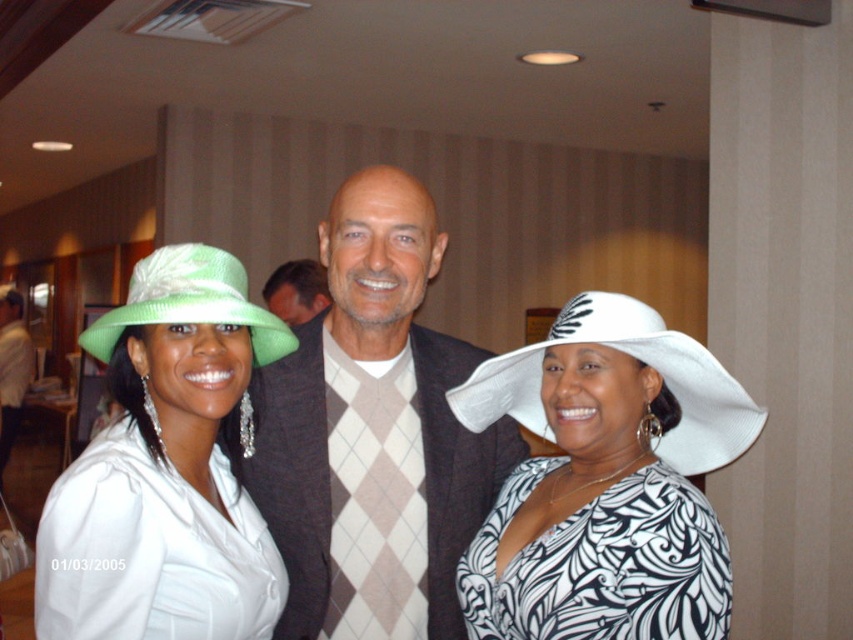
Question: Which object is closer to the camera taking this photo?

Choices:
 (A) green woven hat at left
 (B) matte green fabric hat at left
 (C) black and white printed dress at center

Answer: (B)

Question: Which point is farther to the camera?

Choices:
 (A) matte green fabric hat at left
 (B) black and white printed dress at center
 (C) argyle sweater at center

Answer: (C)

Question: Is matte green hat at left to the left of white textured sweater at center from the viewer's perspective?

Choices:
 (A) no
 (B) yes

Answer: (A)

Question: Is matte green hat at left closer to camera compared to white printed dress at center?

Choices:
 (A) yes
 (B) no

Answer: (A)

Question: Among these objects, which one is nearest to the camera?

Choices:
 (A) white textured sweater at center
 (B) matte green hat at left
 (C) light brown sweater at center

Answer: (B)

Question: Is matte green fabric hat at left closer to the viewer compared to black and white printed dress at center?

Choices:
 (A) no
 (B) yes

Answer: (B)